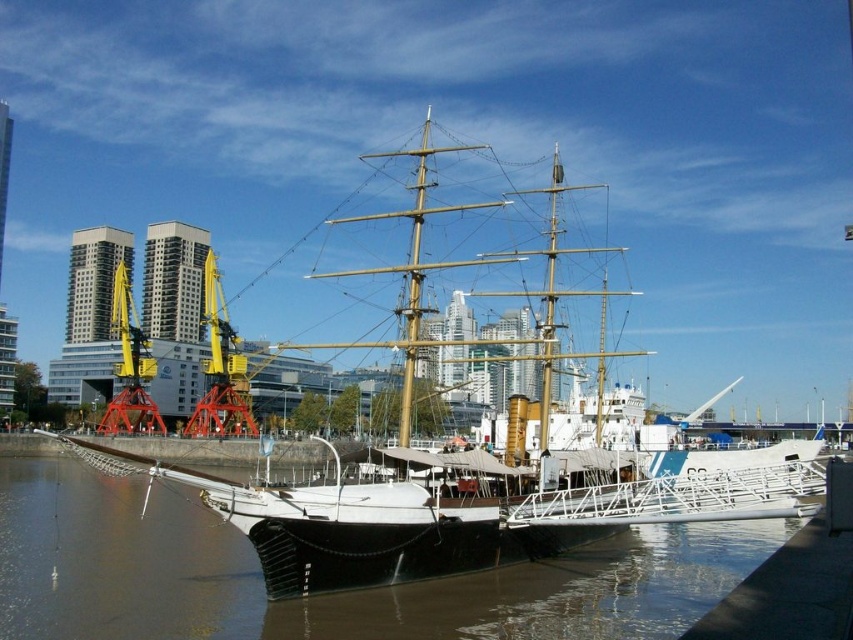
You are a photographer planning to take a photo of the waterfront scene. You want to ensure that the white wooden ship at center is taller than the smooth brown water at center in the final image. Based on the scene description, will this arrangement naturally occur?

Yes, the white wooden ship at center is taller than the smooth brown water at center, so this arrangement will naturally occur in the photo.

You are a photographer planning to take a photo of the waterfront scene. You want to ensure that both the smooth brown water at center and the white wooden ship at center are clearly visible. Which object should you focus on first if you want to capture the larger one in your frame?

The white wooden ship at center is larger than the smooth brown water at center, so you should focus on the white wooden ship at center first to capture its full size.

You are standing on the pier and looking at the smooth brown water at center and the white wooden ship at center. Which object is closer to you?

The smooth brown water at center is closer to you because it is in front of the white wooden ship at center.